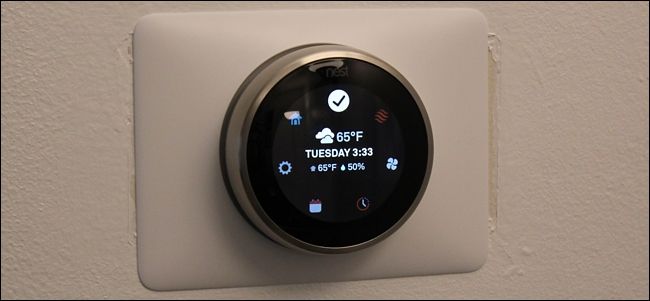
Locate an element on the screen. wall is located at coordinates (552, 183).